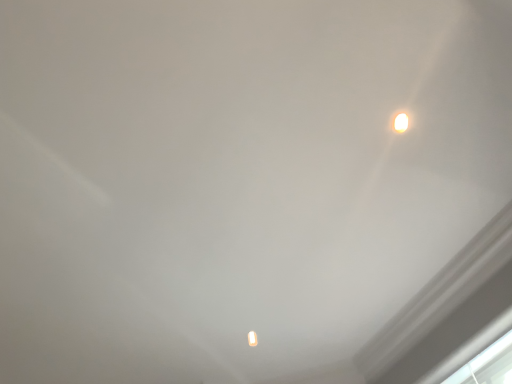
Question: Relative to white glossy lamp at upper right, is transparent glass window at lower right in front or behind?

Choices:
 (A) front
 (B) behind

Answer: (B)

Question: From the image's perspective, is transparent glass window at lower right located above or below white glossy lamp at upper right?

Choices:
 (A) above
 (B) below

Answer: (B)

Question: In terms of height, does transparent glass window at lower right look taller or shorter compared to white glossy lamp at upper right?

Choices:
 (A) tall
 (B) short

Answer: (A)

Question: Looking at their shapes, would you say white glossy lamp at upper right is wider or thinner than transparent glass window at lower right?

Choices:
 (A) thin
 (B) wide

Answer: (A)

Question: Considering their positions, is white glossy lamp at upper right located in front of or behind transparent glass window at lower right?

Choices:
 (A) front
 (B) behind

Answer: (A)

Question: Is white glossy lamp at upper right taller or shorter than transparent glass window at lower right?

Choices:
 (A) tall
 (B) short

Answer: (B)

Question: From a real-world perspective, is white glossy lamp at upper right positioned above or below transparent glass window at lower right?

Choices:
 (A) above
 (B) below

Answer: (A)